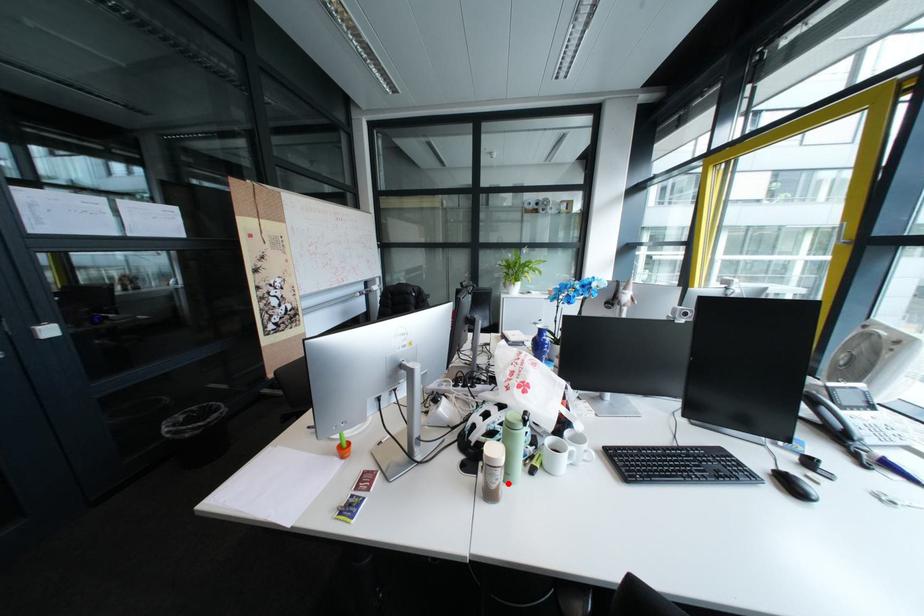
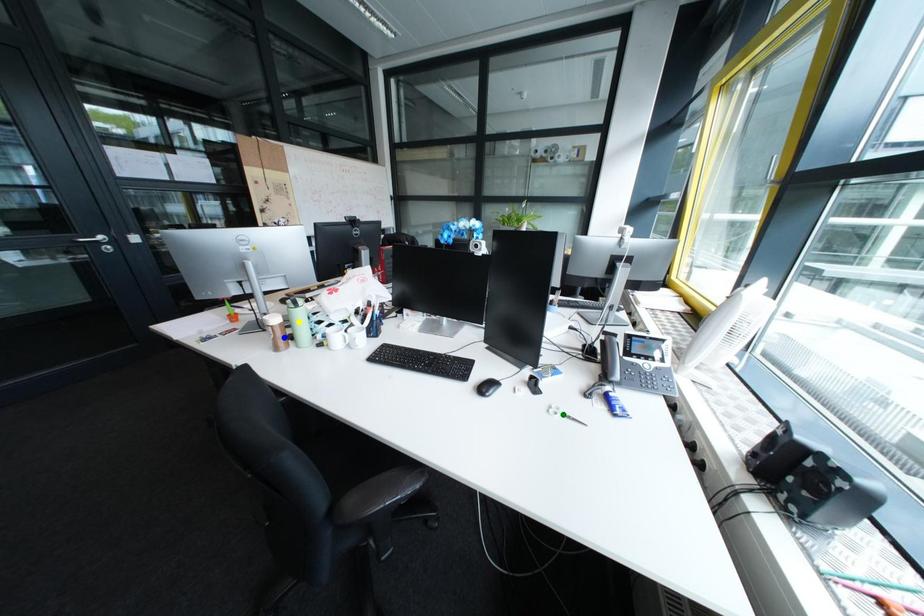
Question: I am providing you with two images of the same scene from different viewpoints. A red point is marked on the first image. You are given multiple points on the second image. In image 2, which mark is for the same physical point as the one in image 1?

Choices:
 (A) green point
 (B) yellow point
 (C) blue point

Answer: (C)